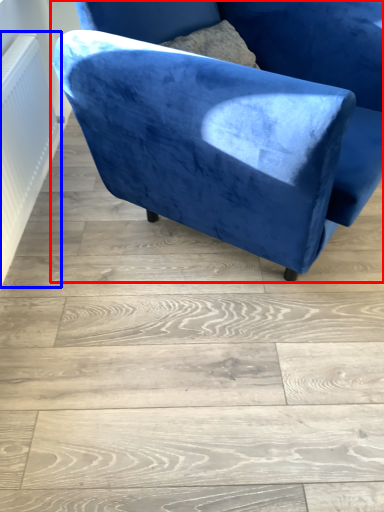
Question: Among these objects, which one is farthest to the camera, chair (highlighted by a red box) or radiator (highlighted by a blue box)?

Choices:
 (A) chair
 (B) radiator

Answer: (B)